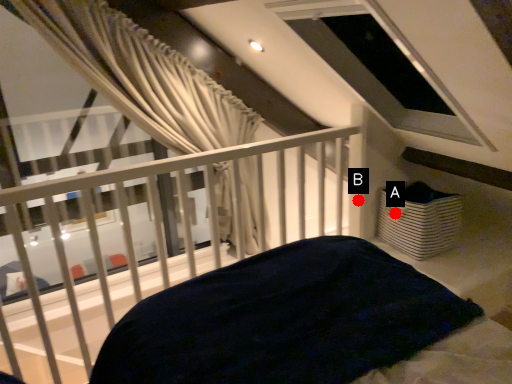
Question: Two points are circled on the image, labeled by A and B beside each circle. Which point is further to the camera?

Choices:
 (A) A is further
 (B) B is further

Answer: (B)